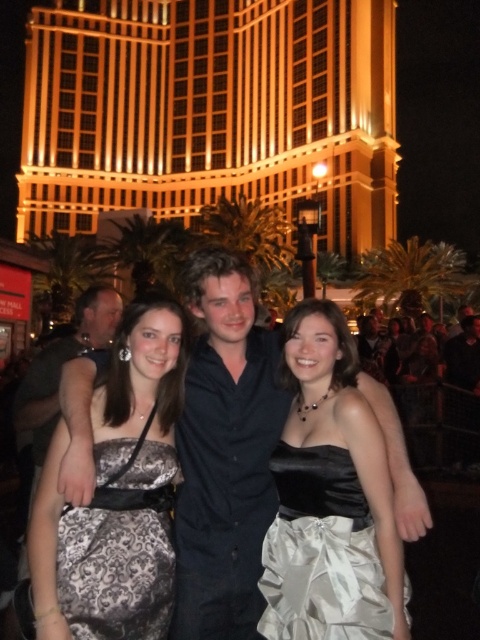
Is golden glass building at upper center taller than silver satin dress at center?

Yes, golden glass building at upper center is taller than silver satin dress at center.

Is the position of golden glass building at upper center less distant than that of silver satin dress at center?

No.

Is point (356, 166) in front of point (63, 628)?

No, (356, 166) is further to viewer.

Find the location of a particular element. The image size is (480, 640). golden glass building at upper center is located at coordinates (210, 112).

Can you confirm if silver satin dress at center is shorter than satin dress at center?

No.

Between silver satin dress at center and satin dress at center, which one appears on the left side from the viewer's perspective?

From the viewer's perspective, silver satin dress at center appears more on the left side.

The width and height of the screenshot is (480, 640). I want to click on silver satin dress at center, so click(117, 493).

Find the location of a particular element. The height and width of the screenshot is (640, 480). silver satin dress at center is located at coordinates (117, 493).

Which is more to the right, golden glass building at upper center or satin dress at center?

From the viewer's perspective, satin dress at center appears more on the right side.

Which is below, golden glass building at upper center or satin dress at center?

satin dress at center is below.

Measure the distance between point (x=240, y=16) and camera.

Point (x=240, y=16) is 346.31 feet away from camera.

This screenshot has height=640, width=480. I want to click on golden glass building at upper center, so click(210, 112).